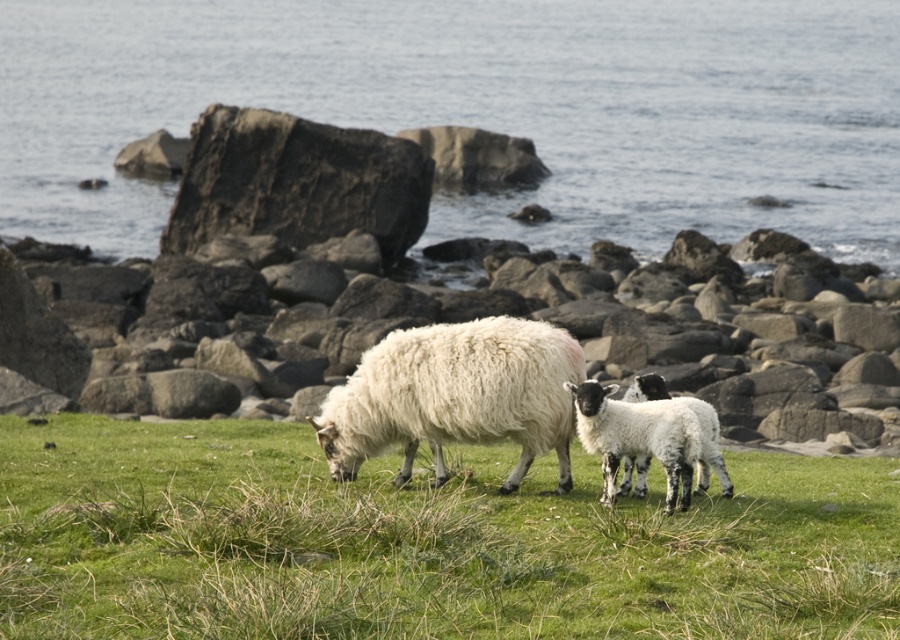
Is green soft grass at center to the left of smooth gray rock at center from the viewer's perspective?

Correct, you'll find green soft grass at center to the left of smooth gray rock at center.

Who is positioned more to the left, green soft grass at center or smooth gray rock at center?

Positioned to the left is green soft grass at center.

The height and width of the screenshot is (640, 900). What do you see at coordinates (421, 544) in the screenshot?
I see `green soft grass at center` at bounding box center [421, 544].

Locate an element on the screen. This screenshot has width=900, height=640. green soft grass at center is located at coordinates (421, 544).

Is point (866, 442) behind point (590, 438)?

Yes, it is behind point (590, 438).

Which of these two, smooth gray rock at center or white woolen sheep at center, stands shorter?

With less height is white woolen sheep at center.

Which is behind, point (163, 308) or point (599, 449)?

Positioned behind is point (163, 308).

Identify the location of smooth gray rock at center. The width and height of the screenshot is (900, 640). (419, 284).

Is green soft grass at center further to the viewer compared to white woolen sheep at center?

Yes, it is.

Describe the element at coordinates (421, 544) in the screenshot. I see `green soft grass at center` at that location.

Locate an element on the screen. green soft grass at center is located at coordinates (421, 544).